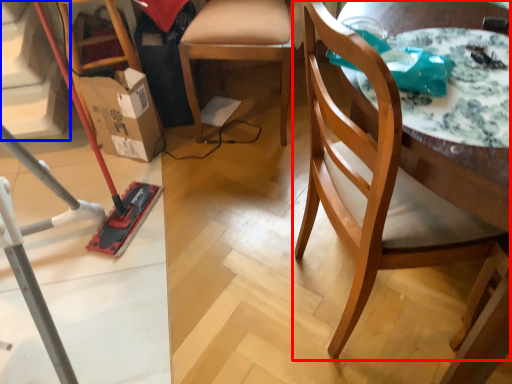
Question: Which point is closer to the camera, chair (highlighted by a red box) or stairwell (highlighted by a blue box)?

Choices:
 (A) chair
 (B) stairwell

Answer: (A)